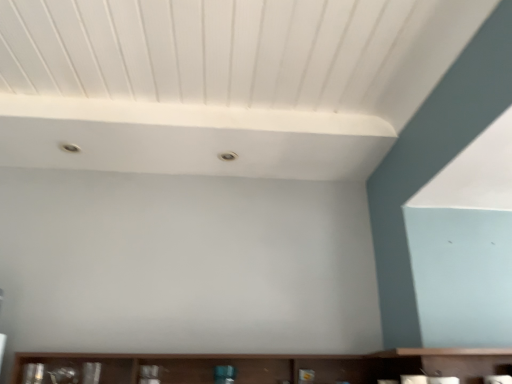
Question: Should I look upward or downward to see brown wooden shelf at lower center?

Choices:
 (A) down
 (B) up

Answer: (A)